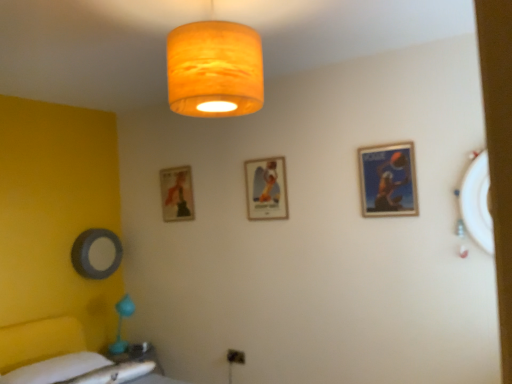
Identify the location of empty space that is ontop of matte white table at lower left (from a real-world perspective). This screenshot has width=512, height=384. (129, 347).